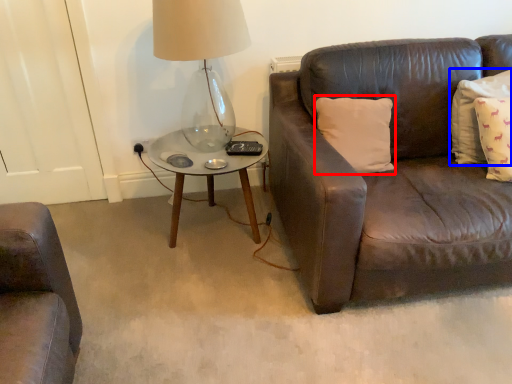
Question: Which point is closer to the camera, pillow (highlighted by a red box) or pillow (highlighted by a blue box)?

Choices:
 (A) pillow
 (B) pillow

Answer: (B)